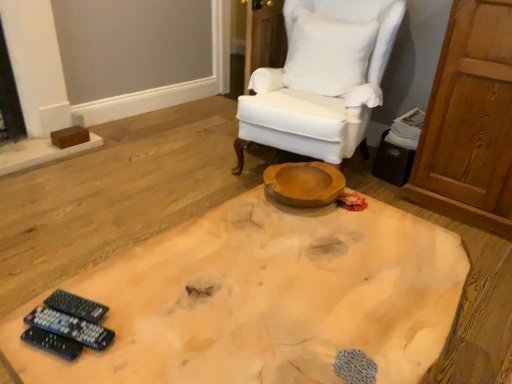
This screenshot has height=384, width=512. Find the location of `free space to the right of black plastic remote controls at lower left, the 2th remote control viewed from the back`. free space to the right of black plastic remote controls at lower left, the 2th remote control viewed from the back is located at coordinates (147, 322).